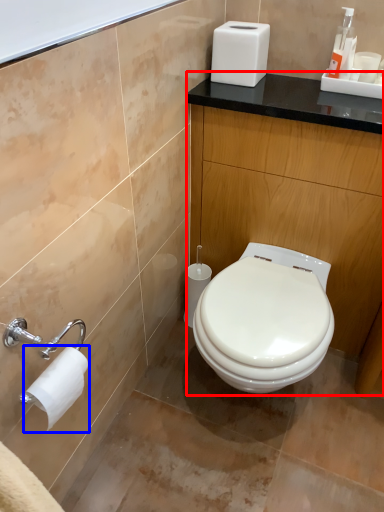
Question: Among these objects, which one is farthest to the camera, counter (highlighted by a red box) or toilet paper (highlighted by a blue box)?

Choices:
 (A) counter
 (B) toilet paper

Answer: (A)